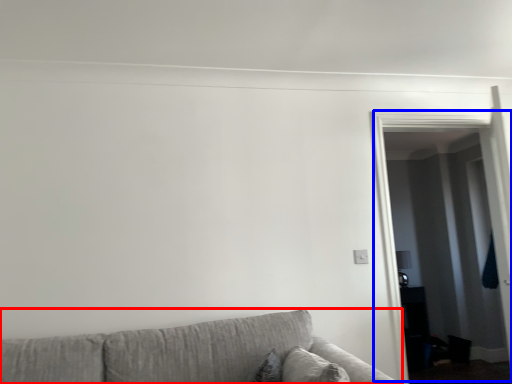
Question: Which object is further to the camera taking this photo, studio couch (highlighted by a red box) or glass door (highlighted by a blue box)?

Choices:
 (A) studio couch
 (B) glass door

Answer: (B)